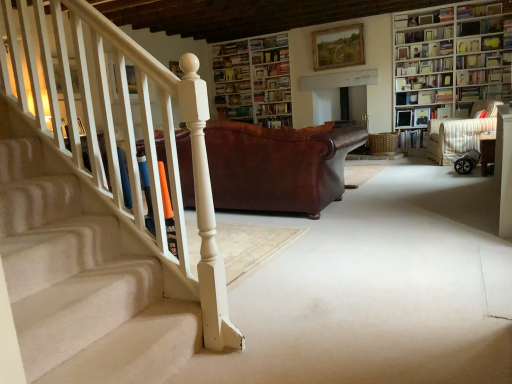
This screenshot has height=384, width=512. I want to click on free location in front of brown leather couch at center, so 325,254.